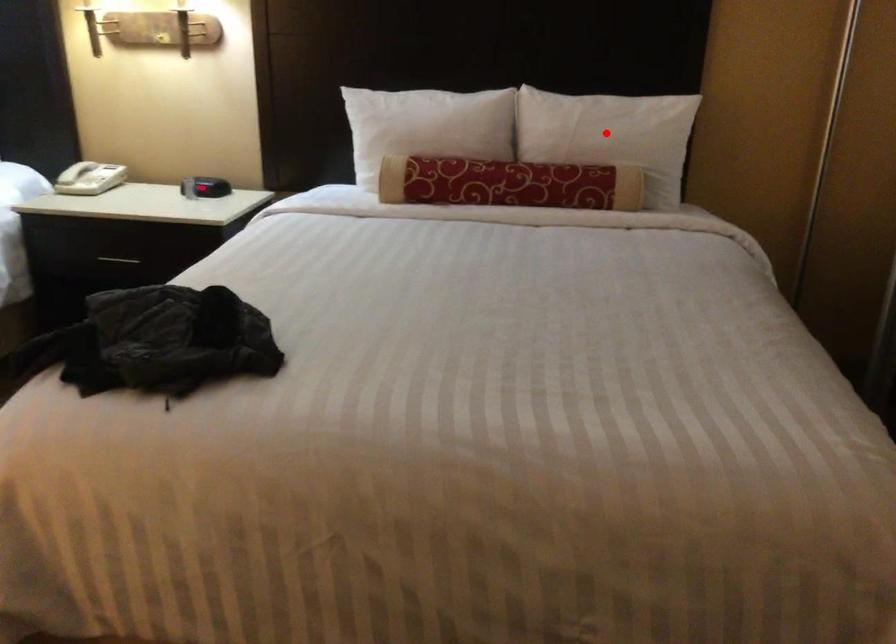
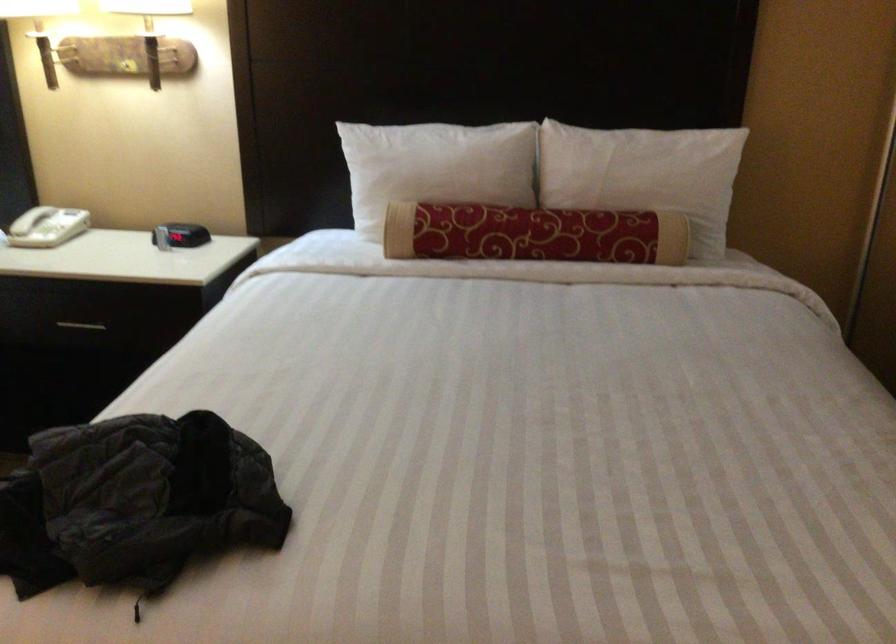
Question: I am providing you with two images of the same scene from different viewpoints. In image1, a red point is highlighted. Considering the same 3D point in image2, which of the following is correct?

Choices:
 (A) It is closer
 (B) It is farther

Answer: (A)